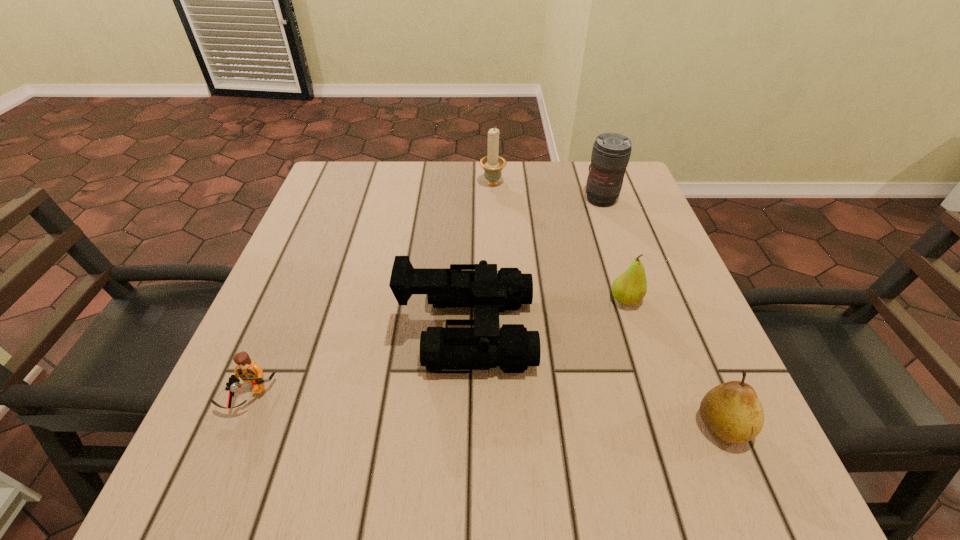
The height and width of the screenshot is (540, 960). What are the coordinates of `free spot between the leftmost object and the candle_holder` in the screenshot? It's located at (371, 289).

Identify the location of free space that is in between the binoculars and the left pear. Image resolution: width=960 pixels, height=540 pixels. (547, 315).

The height and width of the screenshot is (540, 960). I want to click on vacant space that is in between the leftmost object and the candle_holder, so click(371, 289).

I want to click on vacant space in between the Lego and the right pear, so (x=486, y=411).

You are a GUI agent. You are given a task and a screenshot of the screen. Output one action in this format:
    pyautogui.click(x=<x>, y=<y>)
    Task: Click on the empty space between the candle_holder and the Lego
    
    Given the screenshot: What is the action you would take?
    pyautogui.click(x=371, y=289)

Identify which object is the fourth closest to the right pear. Please provide its 2D coordinates. Your answer should be formatted as a tuple, i.e. [(x, y)], where the tuple contains the x and y coordinates of a point satisfying the conditions above.

[(492, 164)]

At what (x,y) coordinates should I click in order to perform the action: click on object that stands as the fourth closest to the leftmost object. Please return your answer as a coordinate pair (x, y). Looking at the image, I should click on (732, 411).

Identify the location of free space that satisfies the following two spatial constraints: 1. on the side of the telephoto lens where the control switches are located; 2. on the left side of the right pear. (680, 426).

Locate an element on the screen. The height and width of the screenshot is (540, 960). free location that satisfies the following two spatial constraints: 1. holding a crossbow in the hands of the leftmost object; 2. on the right side of the right pear is located at coordinates (237, 426).